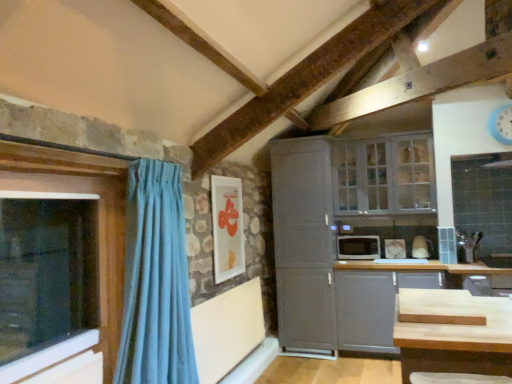
Question: Should I look upward or downward to see white glass cabinet at upper right, arranged as the 2th window when viewed from the left?

Choices:
 (A) up
 (B) down

Answer: (A)

Question: Is blue plastic clock at upper right taller than transparent glass window at left, acting as the 1th window starting from the front?

Choices:
 (A) no
 (B) yes

Answer: (A)

Question: Does blue plastic clock at upper right contain transparent glass window at left, placed as the 1th window when sorted from left to right?

Choices:
 (A) yes
 (B) no

Answer: (B)

Question: From the image's perspective, is blue plastic clock at upper right located beneath transparent glass window at left, acting as the 1th window starting from the front?

Choices:
 (A) no
 (B) yes

Answer: (A)

Question: From the image's perspective, is blue plastic clock at upper right located above transparent glass window at left, acting as the 1th window starting from the front?

Choices:
 (A) yes
 (B) no

Answer: (A)

Question: Considering the relative sizes of blue plastic clock at upper right and transparent glass window at left, arranged as the 2th window when viewed from the back, in the image provided, is blue plastic clock at upper right bigger than transparent glass window at left, arranged as the 2th window when viewed from the back,?

Choices:
 (A) yes
 (B) no

Answer: (B)

Question: Is blue plastic clock at upper right positioned before transparent glass window at left, arranged as the 2th window when viewed from the back?

Choices:
 (A) yes
 (B) no

Answer: (B)

Question: From a real-world perspective, is white glossy picture frame at upper center located beneath matte gray cabinet at lower right, which ranks as the first cabinetry in right-to-left order?

Choices:
 (A) yes
 (B) no

Answer: (B)

Question: From a real-world perspective, is white glossy picture frame at upper center positioned over matte gray cabinet at lower right, which ranks as the first cabinetry in right-to-left order, based on gravity?

Choices:
 (A) yes
 (B) no

Answer: (A)

Question: Is white glossy picture frame at upper center positioned far away from matte gray cabinet at lower right, placed as the 2th cabinetry when sorted from left to right?

Choices:
 (A) no
 (B) yes

Answer: (B)

Question: Does white glossy picture frame at upper center appear on the right side of matte gray cabinet at lower right, which ranks as the first cabinetry in right-to-left order?

Choices:
 (A) yes
 (B) no

Answer: (B)

Question: From the image's perspective, would you say white glossy picture frame at upper center is shown under matte gray cabinet at lower right, placed as the 2th cabinetry when sorted from left to right?

Choices:
 (A) yes
 (B) no

Answer: (B)

Question: Is white glossy picture frame at upper center looking in the opposite direction of matte gray cabinet at lower right, which ranks as the first cabinetry in right-to-left order?

Choices:
 (A) no
 (B) yes

Answer: (A)

Question: Is white glossy picture frame at upper center wider than light blue fabric curtain at left?

Choices:
 (A) no
 (B) yes

Answer: (A)